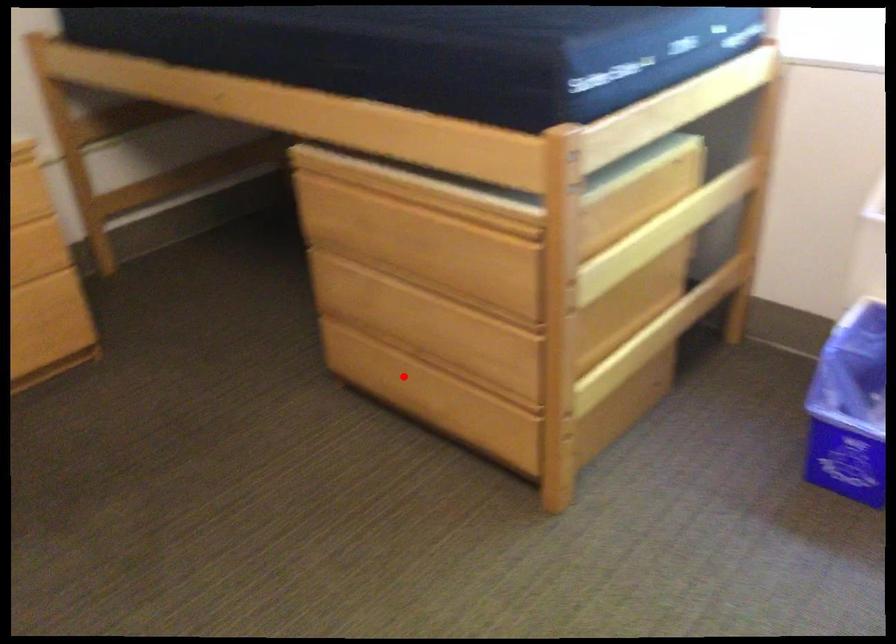
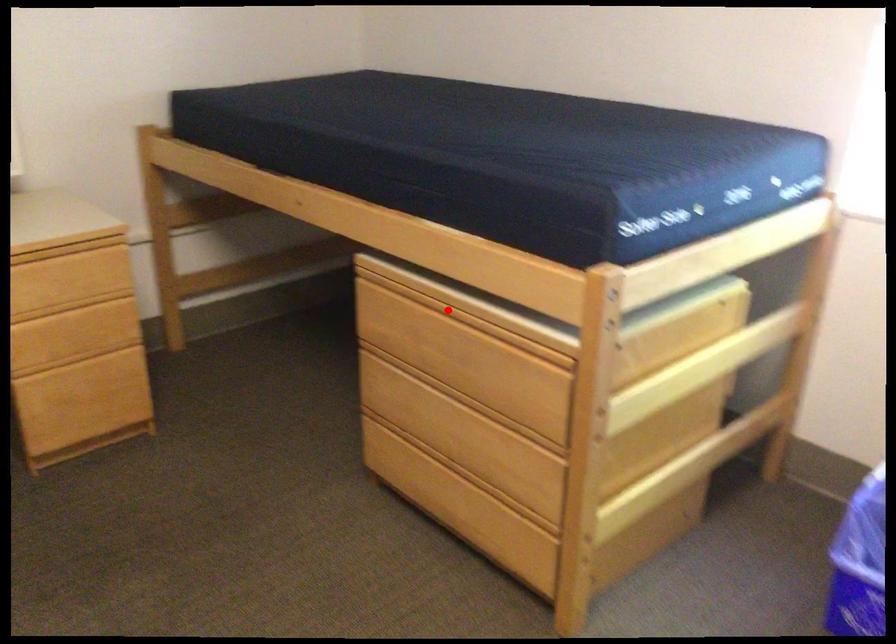
I am providing you with two images of the same scene from different viewpoints. A red point is marked on the first image and another point is marked on the second image. Do the highlighted points in image1 and image2 indicate the same real-world spot?

No